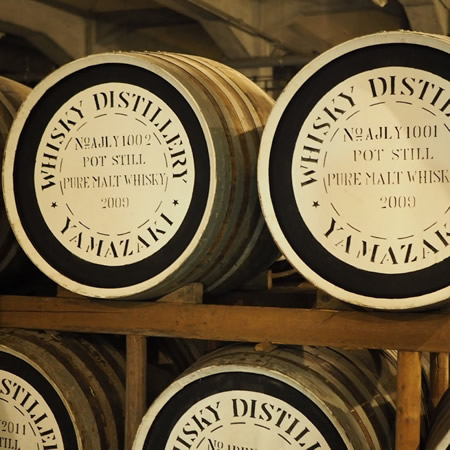
Locate an element on the screen. The image size is (450, 450). wood beams on ceiling is located at coordinates (269, 30).